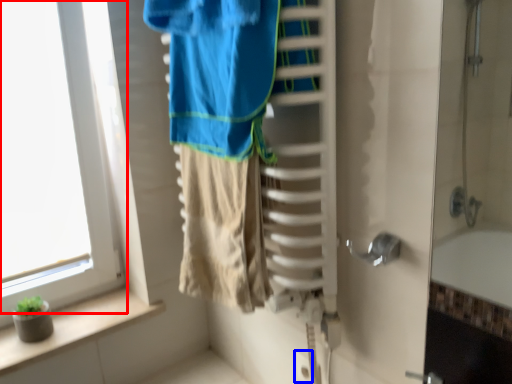
Question: Which object appears closest to the camera in this image, window (highlighted by a red box) or electric outlet (highlighted by a blue box)?

Choices:
 (A) window
 (B) electric outlet

Answer: (A)